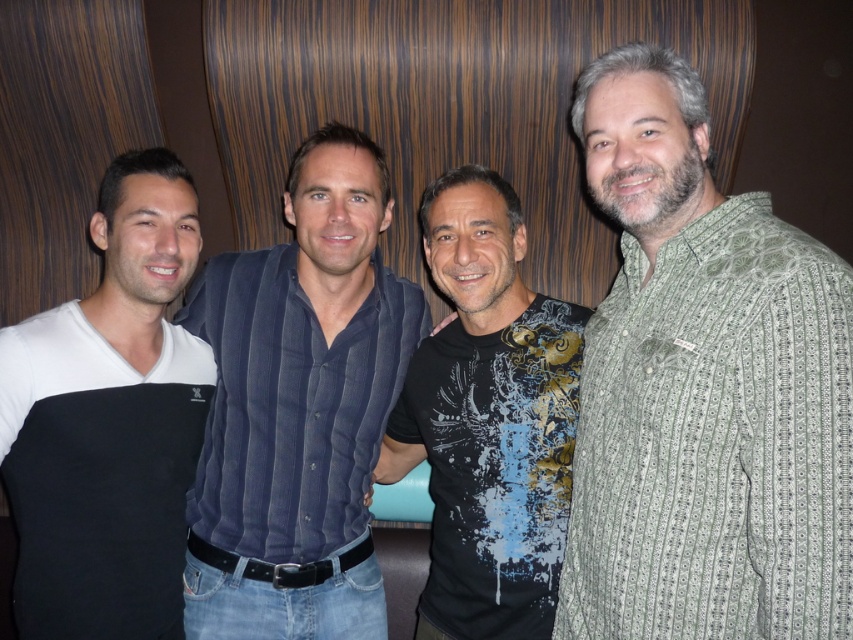
Question: Which point appears closest to the camera in this image?

Choices:
 (A) (581, 596)
 (B) (486, 188)

Answer: (A)

Question: Among these objects, which one is nearest to the camera?

Choices:
 (A) black printed t-shirt at center
 (B) white cotton t-shirt at left
 (C) dark blue corduroy shirt at center

Answer: (B)

Question: Considering the relative positions of green striped shirt at right and white cotton t-shirt at left in the image provided, where is green striped shirt at right located with respect to white cotton t-shirt at left?

Choices:
 (A) above
 (B) below

Answer: (A)

Question: In this image, where is white cotton t-shirt at left located relative to black printed t-shirt at center?

Choices:
 (A) above
 (B) below

Answer: (A)

Question: Which point is closer to the camera taking this photo?

Choices:
 (A) (28, 396)
 (B) (686, 316)

Answer: (B)

Question: Can you confirm if white cotton t-shirt at left is bigger than black printed t-shirt at center?

Choices:
 (A) no
 (B) yes

Answer: (A)